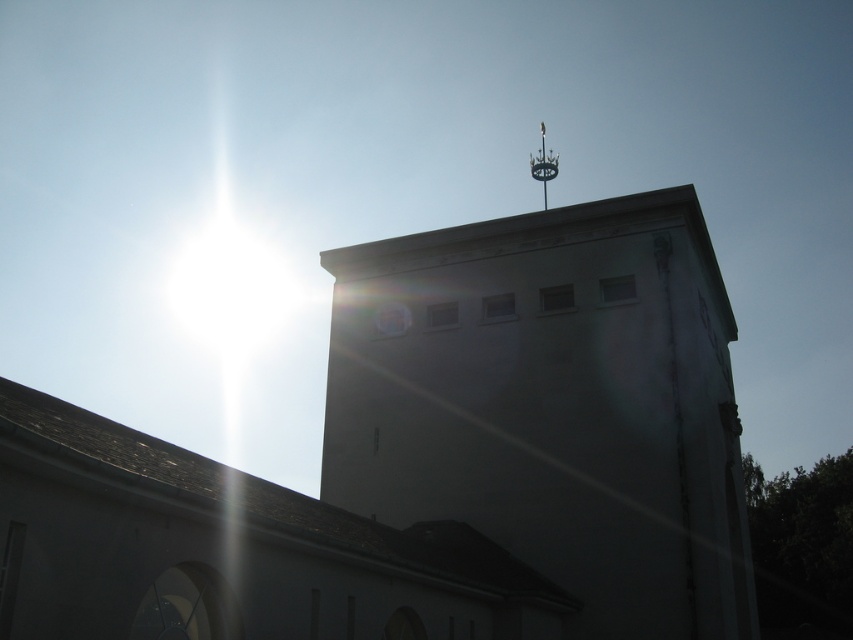
Question: Is white matte tower at upper center positioned at the back of polished metal spire at upper center?

Choices:
 (A) yes
 (B) no

Answer: (B)

Question: Which of the following is the farthest from the observer?

Choices:
 (A) polished metal spire at upper center
 (B) white matte tower at upper center

Answer: (A)

Question: Is white matte tower at upper center to the right of polished metal spire at upper center from the viewer's perspective?

Choices:
 (A) no
 (B) yes

Answer: (A)

Question: Does white matte tower at upper center appear on the right side of polished metal spire at upper center?

Choices:
 (A) yes
 (B) no

Answer: (B)

Question: Which object is closer to the camera taking this photo?

Choices:
 (A) polished metal spire at upper center
 (B) white matte tower at upper center

Answer: (B)